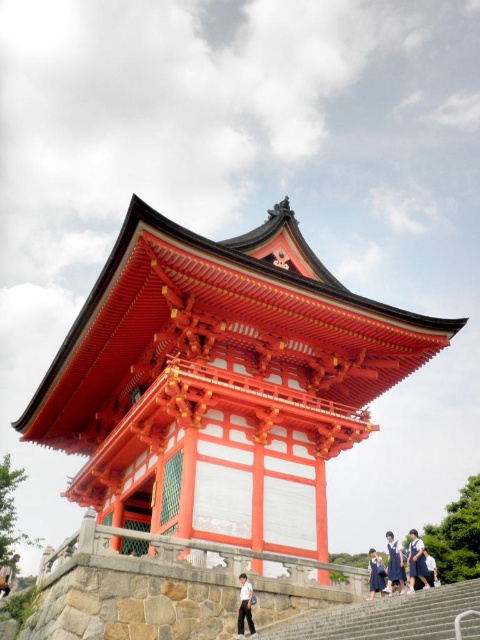
Can you confirm if blue school uniform at lower center is taller than blue school uniform at center?

No.

Is blue school uniform at lower center above blue school uniform at center?

Indeed, blue school uniform at lower center is positioned over blue school uniform at center.

The height and width of the screenshot is (640, 480). Find the location of `blue school uniform at lower center`. blue school uniform at lower center is located at coordinates (417, 561).

Where is `blue school uniform at lower center`? This screenshot has height=640, width=480. blue school uniform at lower center is located at coordinates click(x=417, y=561).

Between shiny lacquered pagoda at center and white uniform at center, which one appears on the right side from the viewer's perspective?

Positioned to the right is white uniform at center.

Between shiny lacquered pagoda at center and white uniform at center, which one has less height?

shiny lacquered pagoda at center

Is point (213, 406) in front of point (400, 564)?

No.

Where is `shiny lacquered pagoda at center`? The image size is (480, 640). shiny lacquered pagoda at center is located at coordinates (220, 381).

Is the position of white uniform at center more distant than that of white uniform pants at lower center?

Yes, white uniform at center is behind white uniform pants at lower center.

The height and width of the screenshot is (640, 480). I want to click on white uniform at center, so click(395, 563).